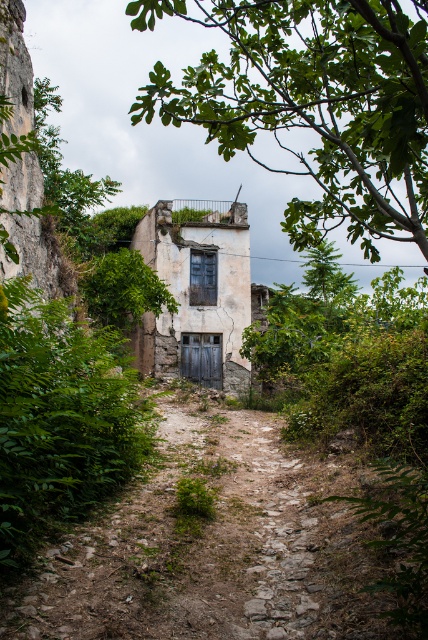
Question: Which point is farther from the camera taking this photo?

Choices:
 (A) (97, 342)
 (B) (152, 211)
 (C) (341, 540)

Answer: (B)

Question: Which object is farther from the camera taking this photo?

Choices:
 (A) weathered stone building at center
 (B) dirt/gravel path at center

Answer: (A)

Question: Which is farther from the dirt/gravel path at center?

Choices:
 (A) green leafy bush at center
 (B) green leafy tree at center

Answer: (B)

Question: Is green leafy tree at upper center thinner than weathered stone building at center?

Choices:
 (A) no
 (B) yes

Answer: (A)

Question: Is green leafy bush at center further to camera compared to weathered stone building at center?

Choices:
 (A) no
 (B) yes

Answer: (A)

Question: Is green leafy tree at upper center above green leafy tree at center?

Choices:
 (A) no
 (B) yes

Answer: (B)